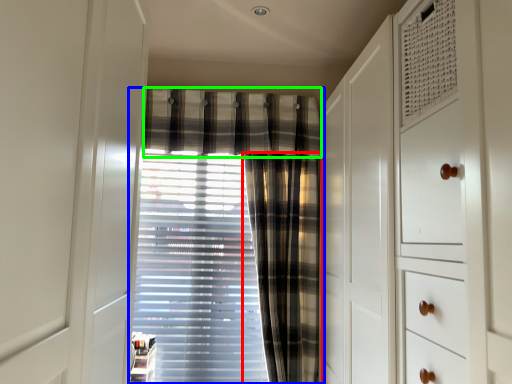
Question: Which object is the farthest from curtain (highlighted by a red box)? Choose among these: curtain (highlighted by a blue box) or plaid (highlighted by a green box).

Choices:
 (A) curtain
 (B) plaid

Answer: (B)